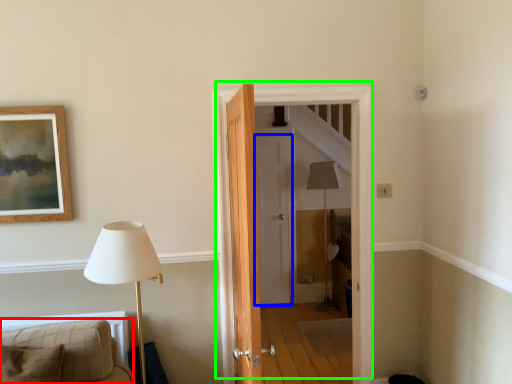
Question: Which object is positioned farthest from furniture (highlighted by a red box)? Select from door (highlighted by a blue box) and door (highlighted by a green box).

Choices:
 (A) door
 (B) door

Answer: (A)